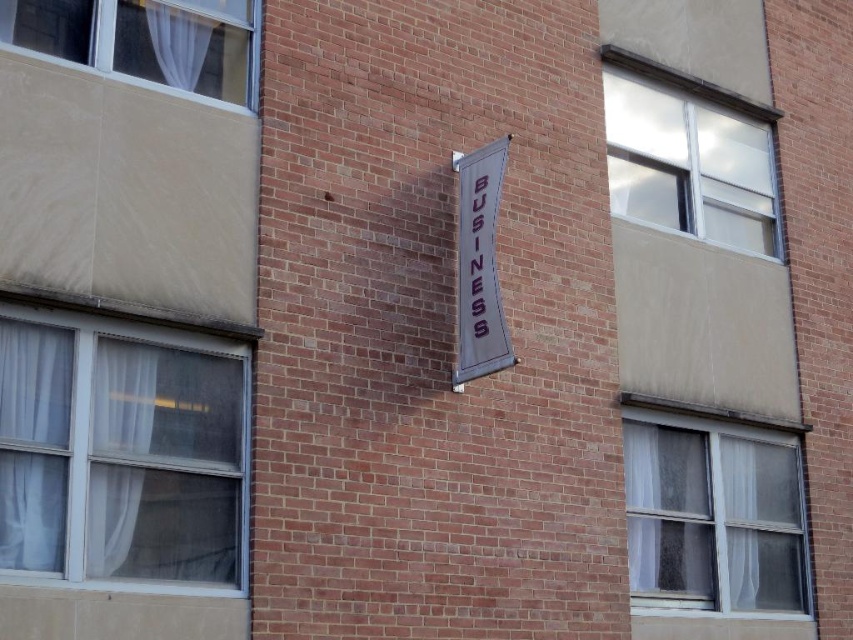
You are standing outside the brick building and want to look into the clear glass window at upper right and the white fabric curtain at upper left. Which window is located to the right of the other?

The clear glass window at upper right is positioned on the right side of the white fabric curtain at upper left.

You are standing outside the brick building and notice two white sheer fabrics. One is labeled as the white sheer curtain at left and the other as the white sheer fabric at lower right. According to the scene, which one is covering the other?

The white sheer curtain at left is positioned over the white sheer fabric at lower right, meaning the curtain is covering the fabric.

You are standing in front of the brick building and want to look through the clear glass window at upper right. Is the white fabric curtain at upper left blocking your view of the window?

The clear glass window at upper right is positioned under the white fabric curtain at upper left, so the curtain is blocking the view of the window.